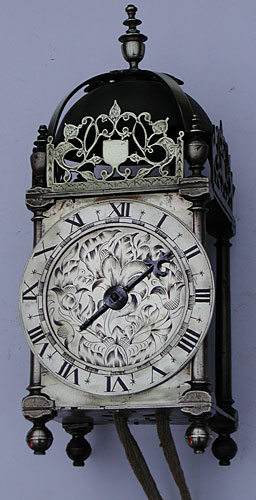
At what (x,y) coordinates should I click in order to perform the action: click on leaf designs on inner clock face. Please return your answer as a coordinate pair (x, y). The width and height of the screenshot is (256, 500). Looking at the image, I should click on (95, 248), (143, 348), (88, 348), (65, 275).